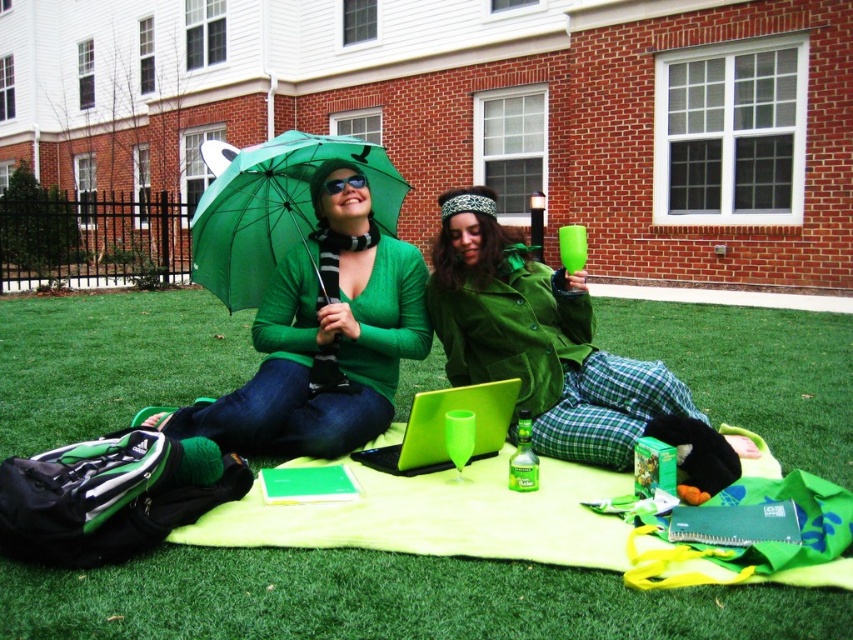
Question: Is green grass at center bigger than matte green laptop at center?

Choices:
 (A) no
 (B) yes

Answer: (B)

Question: From the image, what is the correct spatial relationship of matte green sweater at center in relation to matte green laptop at center?

Choices:
 (A) left
 (B) right

Answer: (A)

Question: Which of the following is the farthest from the observer?

Choices:
 (A) (245, 269)
 (B) (543, 355)
 (C) (393, 456)

Answer: (A)

Question: Estimate the real-world distances between objects in this image. Which object is farther from the green grass at center?

Choices:
 (A) matte green sweater at center
 (B) green matte umbrella at upper center
 (C) green matte jacket at center
 (D) matte green laptop at center

Answer: (B)

Question: Which point is farther to the camera?

Choices:
 (A) matte green sweater at center
 (B) matte green laptop at center

Answer: (A)

Question: Does green grass at center have a greater width compared to green matte umbrella at upper center?

Choices:
 (A) yes
 (B) no

Answer: (A)